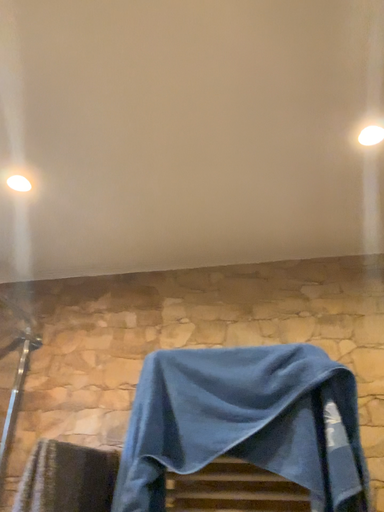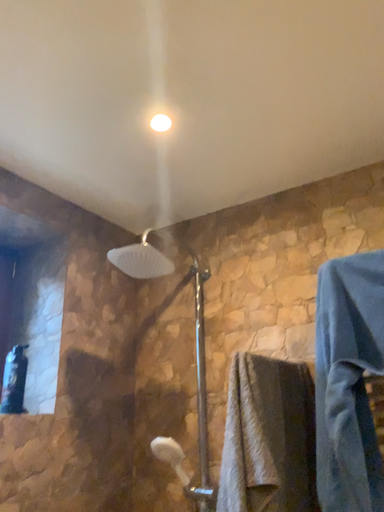
Question: How did the camera likely rotate when shooting the video?

Choices:
 (A) rotated upward
 (B) rotated downward

Answer: (B)